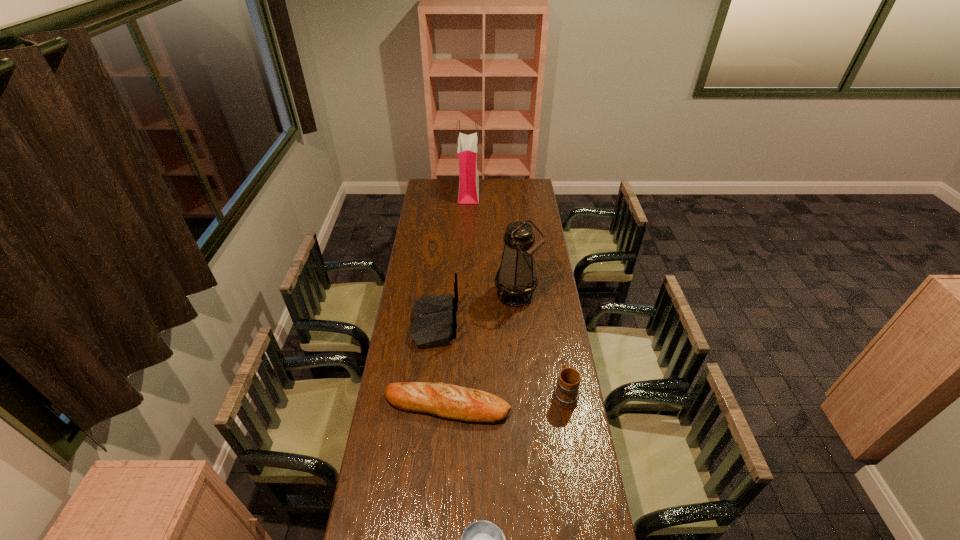
Where is `vacant space located on the side of the fourth tallest object with the handle`? This screenshot has width=960, height=540. vacant space located on the side of the fourth tallest object with the handle is located at coordinates (550, 307).

At what (x,y) coordinates should I click in order to perform the action: click on vacant area situated 0.150m on the right of the baguet. Please return your answer as a coordinate pair (x, y). Looking at the image, I should click on (550, 406).

Locate an element on the screen. object at the far edge is located at coordinates (468, 192).

This screenshot has height=540, width=960. Identify the location of router that is at the left edge. (434, 323).

At what (x,y) coordinates should I click in order to perform the action: click on baguet present at the left edge. Please return your answer as a coordinate pair (x, y). Looking at the image, I should click on (449, 401).

Where is `oil lamp that is at the right edge`? The width and height of the screenshot is (960, 540). oil lamp that is at the right edge is located at coordinates (516, 279).

The image size is (960, 540). Find the location of `mug at the right edge`. mug at the right edge is located at coordinates pos(565,395).

Image resolution: width=960 pixels, height=540 pixels. Find the location of `vacant area at the far edge`. vacant area at the far edge is located at coordinates (448, 186).

This screenshot has width=960, height=540. What are the coordinates of `blank space at the left edge of the desktop` in the screenshot? It's located at (416, 297).

You are a GUI agent. You are given a task and a screenshot of the screen. Output one action in this format:
    pyautogui.click(x=<x>, y=<y>)
    Task: Click on the vacant space at the right edge of the desktop
    This screenshot has width=960, height=540.
    Given the screenshot: What is the action you would take?
    pyautogui.click(x=600, y=516)